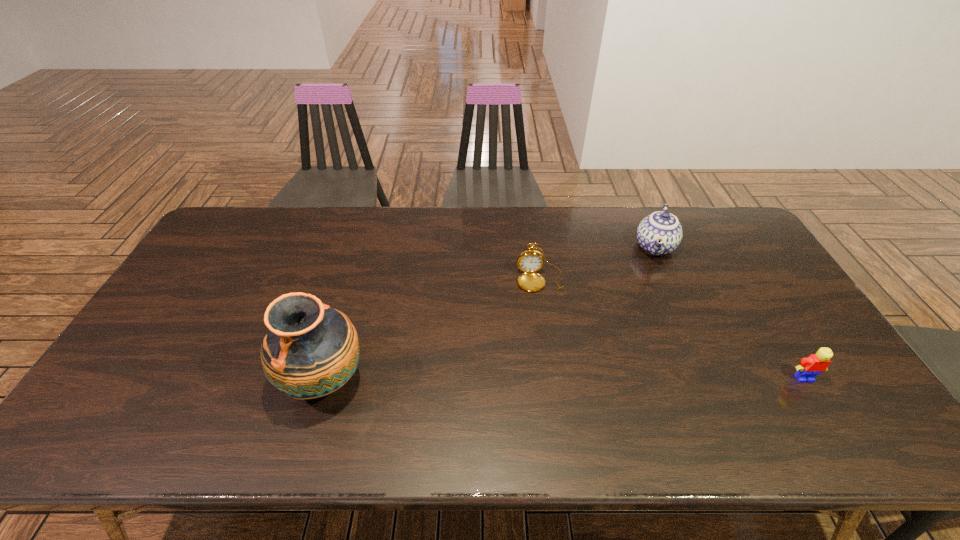
Identify the location of free space on the desktop that is between the pottery and the rightmost object and is positioned on the face of the pocket watch. The width and height of the screenshot is (960, 540). (557, 379).

The width and height of the screenshot is (960, 540). In order to click on free space on the desktop that is between the tallest object and the Lego and is positioned from the spout of the third object from left to right in this screenshot , I will do `click(620, 379)`.